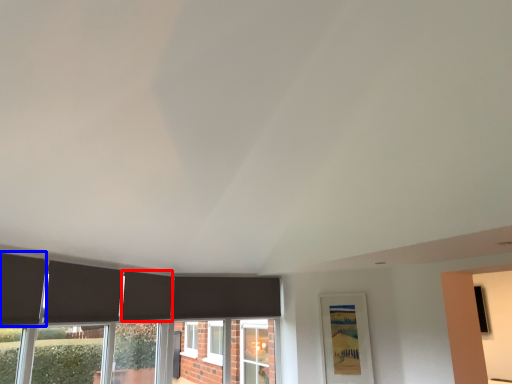
Question: Which object appears farthest to the camera in this image, curtain (highlighted by a red box) or curtain (highlighted by a blue box)?

Choices:
 (A) curtain
 (B) curtain

Answer: (A)